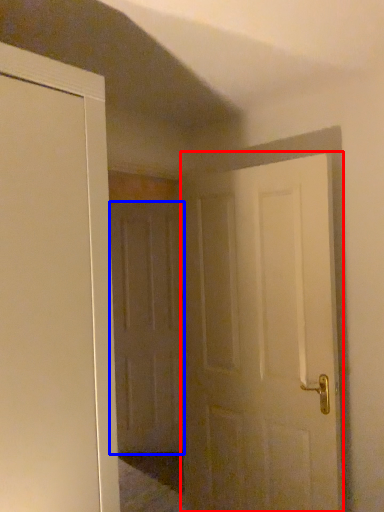
Question: Which object is closer to the camera taking this photo, door (highlighted by a red box) or door (highlighted by a blue box)?

Choices:
 (A) door
 (B) door

Answer: (A)